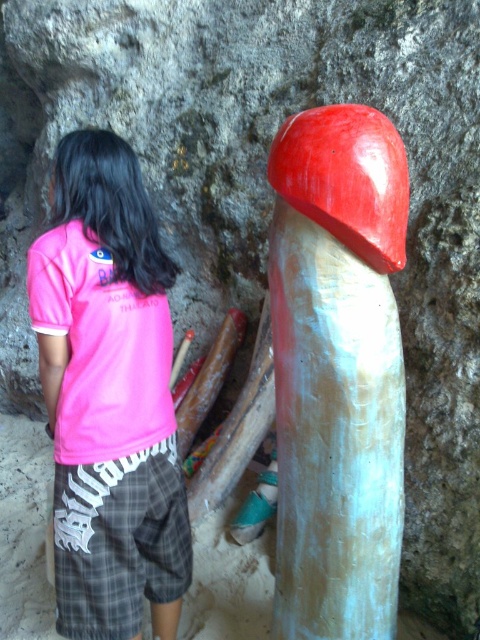
Image resolution: width=480 pixels, height=640 pixels. What do you see at coordinates (337, 371) in the screenshot?
I see `smooth white mushroom at center` at bounding box center [337, 371].

Which is behind, point (283, 216) or point (66, 500)?

Point (66, 500)

Identify the location of smooth white mushroom at center. This screenshot has width=480, height=640. (337, 371).

Identify the location of smooth white mushroom at center. (337, 371).